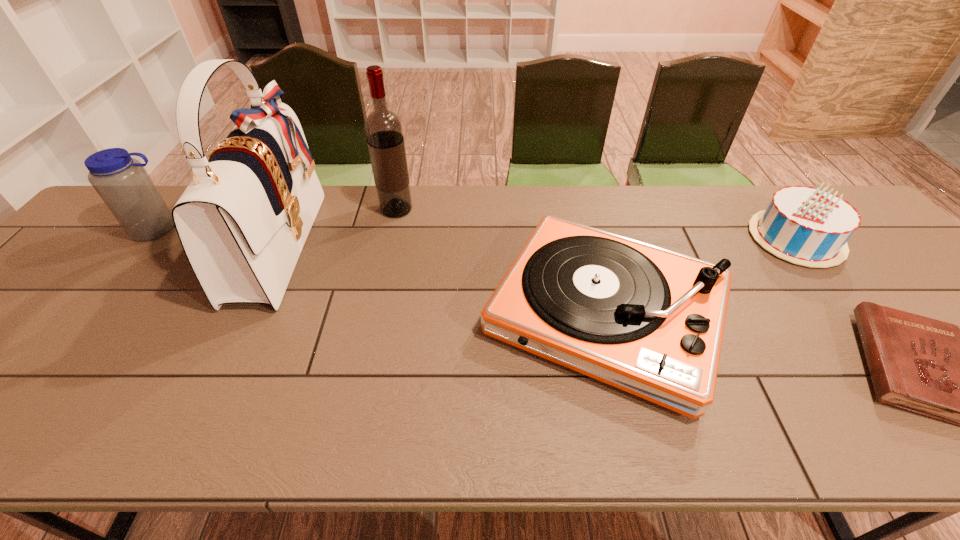
Find the location of `vacant region located on the front of the birthday cake`. vacant region located on the front of the birthday cake is located at coordinates (900, 377).

This screenshot has height=540, width=960. What are the coordinates of `free space located on the right of the fourth object from left to right` in the screenshot? It's located at (852, 313).

Locate an element on the screen. satchel located in the far edge section of the desktop is located at coordinates (243, 220).

You are a GUI agent. You are given a task and a screenshot of the screen. Output one action in this format:
    pyautogui.click(x=<x>, y=<y>)
    Task: Click on the wine bottle located in the far edge section of the desktop
    
    Given the screenshot: What is the action you would take?
    pyautogui.click(x=383, y=128)

Image resolution: width=960 pixels, height=540 pixels. I want to click on water bottle positioned at the far edge, so click(122, 182).

At what (x,y) coordinates should I click in order to perform the action: click on birthday cake situated at the far edge. Please return your answer as a coordinate pair (x, y). The image size is (960, 540). Looking at the image, I should click on (806, 226).

At what (x,y) coordinates should I click in order to perform the action: click on object located at the near edge. Please return your answer as a coordinate pair (x, y). This screenshot has width=960, height=540. Looking at the image, I should click on 649,321.

Where is `object that is at the left edge`? object that is at the left edge is located at coordinates (122, 182).

The image size is (960, 540). Find the location of `object located at the right edge`. object located at the right edge is located at coordinates (806, 226).

Image resolution: width=960 pixels, height=540 pixels. What are the coordinates of `object that is at the far left corner` in the screenshot? It's located at (122, 182).